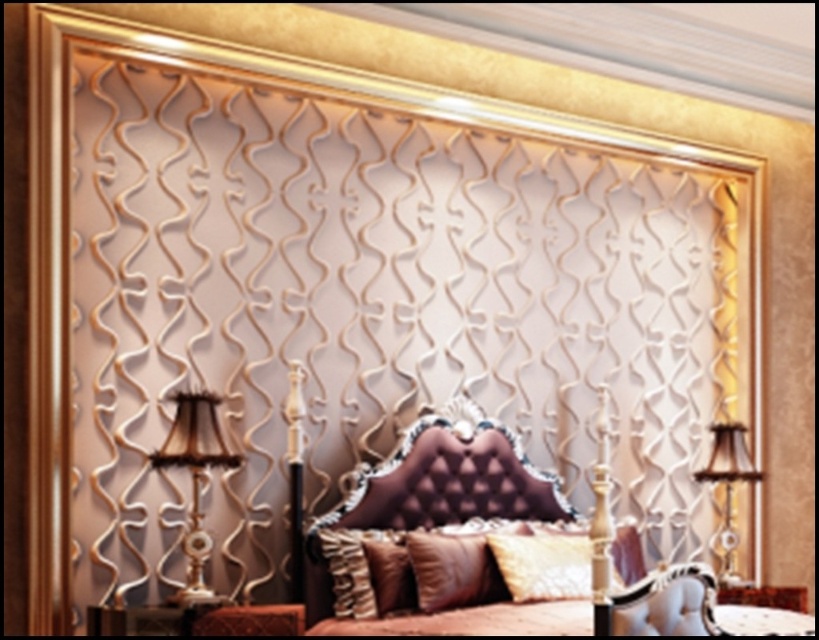
You are arranging a photo shoot in this luxurious bedroom and need to ensure that the gold textured lamp at left and the brown velvet pillow at center are visible in the frame. Since the camera has a limited field of view, which object should you prioritize positioning closer to the camera to ensure it fits within the frame?

The gold textured lamp at left has a larger width than the brown velvet pillow at center, so you should prioritize positioning the gold textured lamp at left closer to the camera to ensure it fits within the frame.

You are arranging a luxurious bedroom and want to place the satin gold pillow at center and brown velvet pillow at center on the bed. Which pillow should you place first if you want the taller one to be visible above the shorter one?

You should place the brown velvet pillow at center first because it is taller than the satin gold pillow at center, allowing it to be visible above.